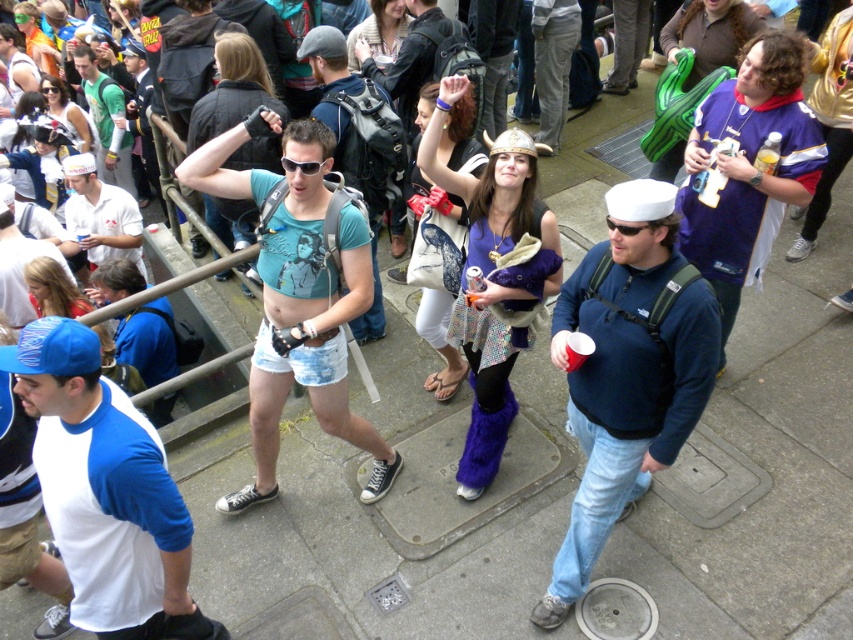
Question: Which object is the closest to the matte blue t-shirt at center?

Choices:
 (A) sailor hat at center
 (B) matte black viking helmet at upper center

Answer: (B)

Question: Can you confirm if white matte cap at left is smaller than matte black sunglasses at upper left?

Choices:
 (A) no
 (B) yes

Answer: (A)

Question: Which object appears farthest from the camera in this image?

Choices:
 (A) matte blue t-shirt at center
 (B) white canvas tote bag at center
 (C) white matte cap at left
 (D) purple jersey at right

Answer: (C)

Question: Is matte blue t-shirt at center positioned in front of blonde hair at lower left?

Choices:
 (A) yes
 (B) no

Answer: (A)

Question: Can you confirm if matte green backpack at upper left is positioned to the right of matte black viking helmet at upper center?

Choices:
 (A) yes
 (B) no

Answer: (B)

Question: Which object is closer to the camera taking this photo?

Choices:
 (A) shiny purple leggings at center
 (B) blue fabric shirt at left
 (C) blue denim shorts at center
 (D) purple jersey at right

Answer: (C)